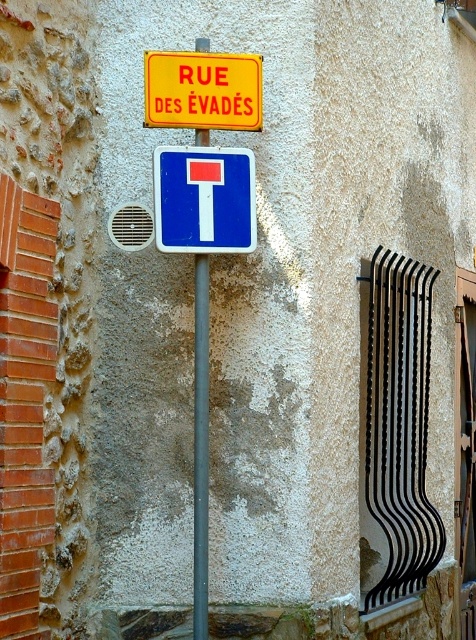
Question: Does yellow plastic sign at upper center have a larger size compared to metallic pole at center?

Choices:
 (A) yes
 (B) no

Answer: (B)

Question: Which of the following is the closest to the observer?

Choices:
 (A) yellow plastic sign at upper center
 (B) metallic pole at center
 (C) blue plastic sign at center

Answer: (C)

Question: Does yellow plastic sign at upper center have a greater width compared to metallic pole at center?

Choices:
 (A) no
 (B) yes

Answer: (B)

Question: Estimate the real-world distances between objects in this image. Which object is farther from the yellow plastic sign at upper center?

Choices:
 (A) metallic pole at center
 (B) blue plastic sign at center

Answer: (A)

Question: Does blue plastic sign at center have a lesser width compared to yellow plastic sign at upper center?

Choices:
 (A) yes
 (B) no

Answer: (A)

Question: Which of the following is the closest to the observer?

Choices:
 (A) (160, 198)
 (B) (198, 355)
 (C) (198, 113)

Answer: (A)